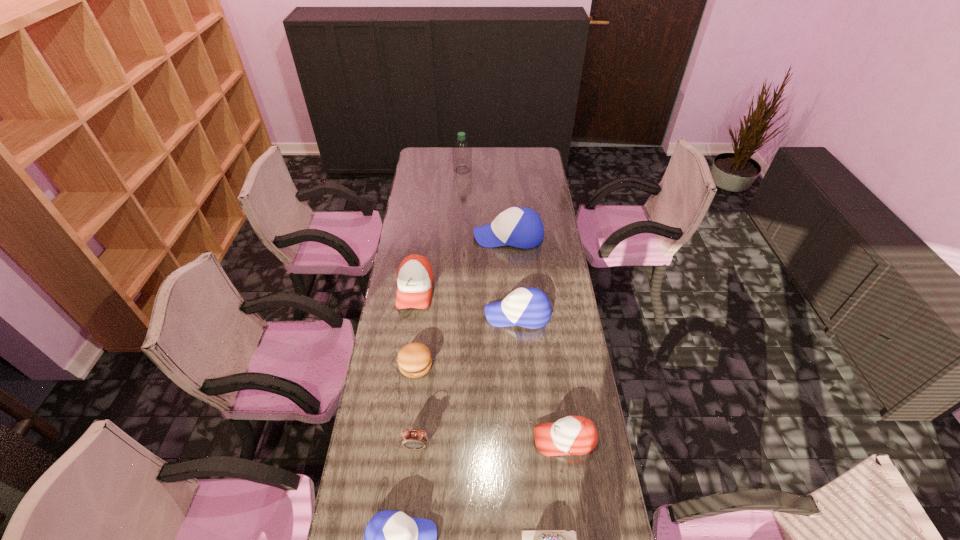
Locate an element on the screen. vacant position located on the face of the alarm clock is located at coordinates (411, 496).

Identify the location of free space located 0.310m on the front-facing side of the second nearest baseball cap. The height and width of the screenshot is (540, 960). (436, 440).

This screenshot has height=540, width=960. Identify the location of free space located on the front-facing side of the second nearest baseball cap. (418, 440).

At what (x,y) coordinates should I click in order to perform the action: click on vacant region located on the front-facing side of the second nearest baseball cap. Please return your answer as a coordinate pair (x, y). This screenshot has width=960, height=540. Looking at the image, I should click on (458, 440).

Where is `vacant space situated 0.080m on the front of the hamburger`? vacant space situated 0.080m on the front of the hamburger is located at coordinates (411, 400).

Identify the location of object present at the far edge. The image size is (960, 540). (462, 153).

Find the location of a particular element. baseball cap present at the left edge is located at coordinates (415, 278).

This screenshot has width=960, height=540. In order to click on alarm clock at the left edge in this screenshot , I will do `click(413, 439)`.

You are a GUI agent. You are given a task and a screenshot of the screen. Output one action in this format:
    pyautogui.click(x=<x>, y=<y>)
    Task: Click on the hamburger that is at the left edge
    The width and height of the screenshot is (960, 540).
    Given the screenshot: What is the action you would take?
    pyautogui.click(x=414, y=360)

The width and height of the screenshot is (960, 540). Identify the location of free region at the left edge of the desktop. (400, 262).